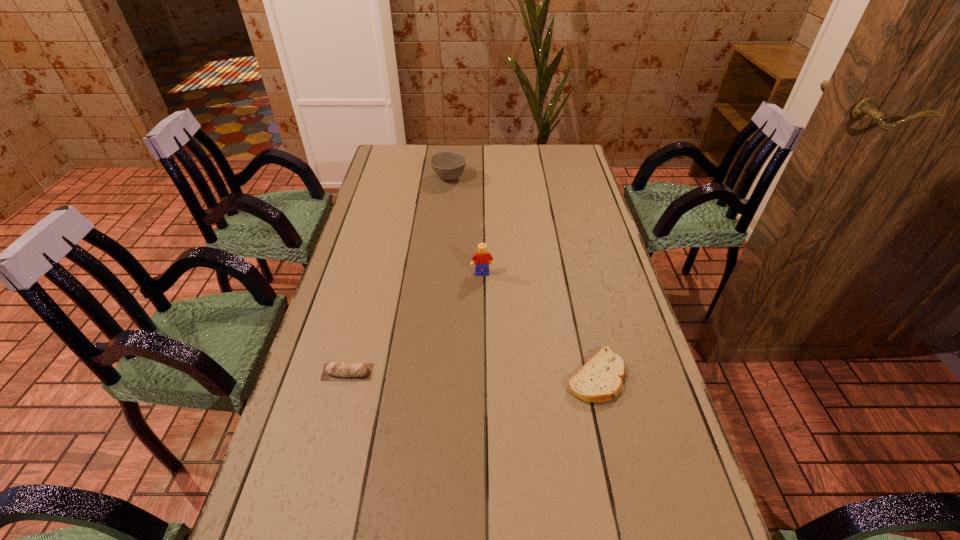
Identify the location of vacant area that satisfies the following two spatial constraints: 1. on the face of the rightmost object; 2. on the right side of the tallest object. coord(483,376).